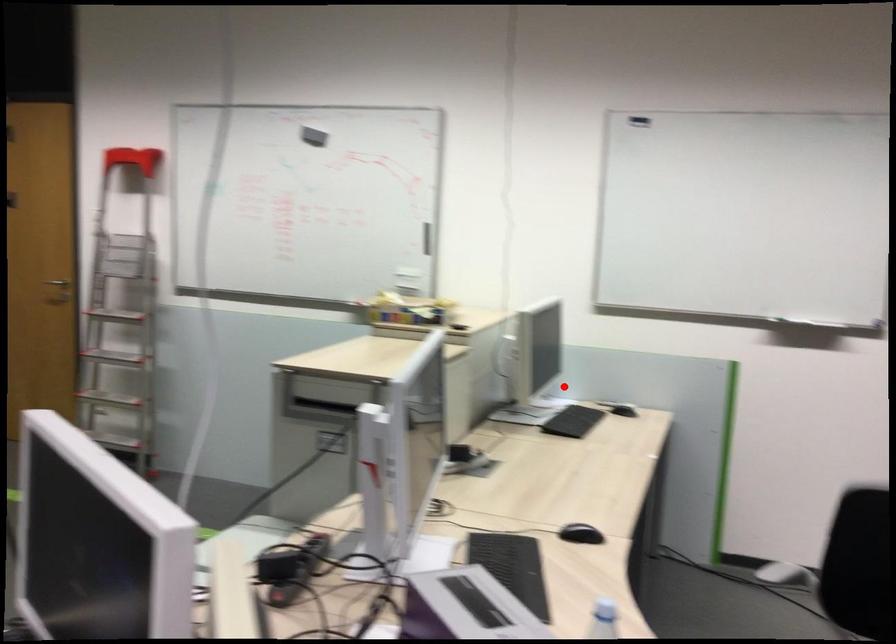
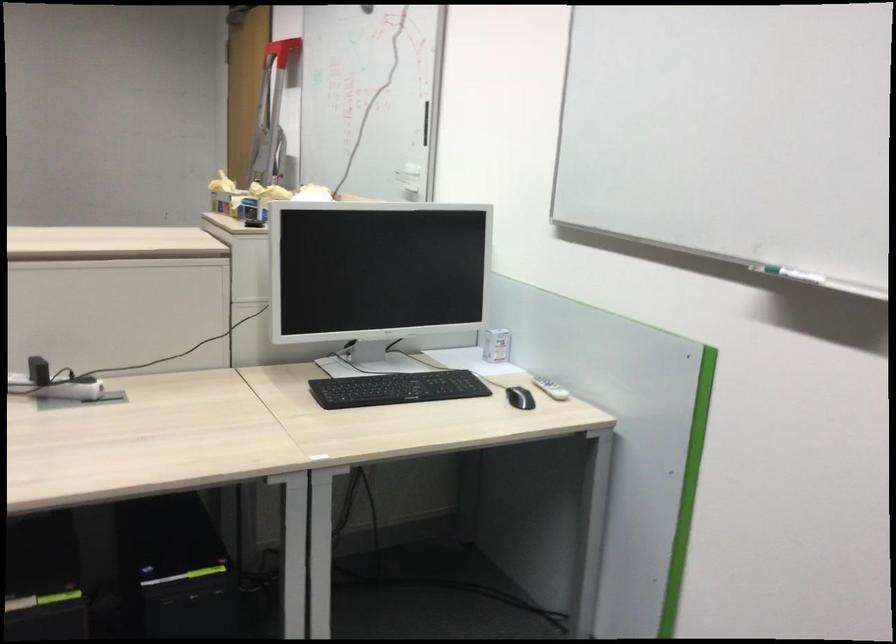
Question: A red point is marked in image1. In image2, is the corresponding 3D point closer to the camera or farther? Reply with the corresponding letter.

Choices:
 (A) The corresponding 3D point is closer.
 (B) The corresponding 3D point is farther.

Answer: (A)